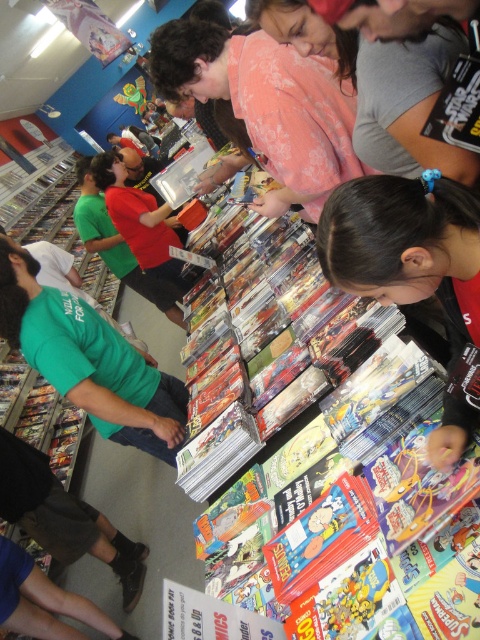
Question: Based on their relative distances, which object is nearer to the black matte hair at center?

Choices:
 (A) green t-shirt at left
 (B) plush yellow toy at center
 (C) pink cotton shirt at upper center

Answer: (C)

Question: Can you confirm if black matte hair at center is positioned to the left of plush yellow toy at center?

Choices:
 (A) yes
 (B) no

Answer: (B)

Question: Estimate the real-world distances between objects in this image. Which object is closer to the pink cotton shirt at upper center?

Choices:
 (A) black matte hair at center
 (B) green t-shirt at left
 (C) plush yellow toy at center

Answer: (A)

Question: Which point is farther to the camera?

Choices:
 (A) pink cotton shirt at upper center
 (B) black matte hair at center
 (C) plush yellow toy at center
 (D) green t-shirt at left

Answer: (C)

Question: Can you confirm if pink cotton shirt at upper center is bigger than green t-shirt at left?

Choices:
 (A) yes
 (B) no

Answer: (B)

Question: Does black matte hair at center have a smaller size compared to plush yellow toy at center?

Choices:
 (A) no
 (B) yes

Answer: (B)